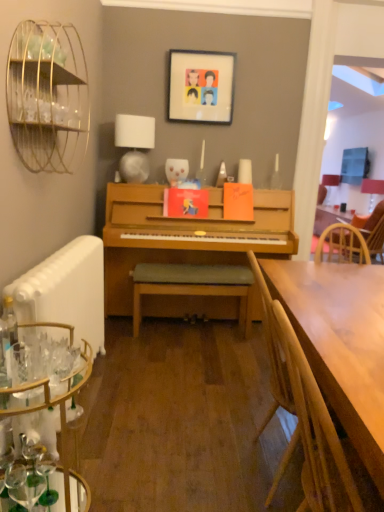
Question: Would you say wooden chair at right, which is the first chair from right to left, is inside or outside wooden bench at center?

Choices:
 (A) outside
 (B) inside

Answer: (A)

Question: From the image's perspective, is wooden chair at right, the second chair from the left, positioned above or below wooden bench at center?

Choices:
 (A) below
 (B) above

Answer: (B)

Question: Which is nearer to the wooden bench at center?

Choices:
 (A) wooden chair at right, which appears as the first chair when viewed from the front
 (B) clear glass desk at lower left
 (C) matte white lampshade at upper right, the first lamp from the right
 (D) wooden chair at right, positioned as the 1th chair in top-to-bottom order
 (E) gold wire birdcage at upper left

Answer: (D)

Question: Based on their relative distances, which object is nearer to the matte plastic picture frame at upper center?

Choices:
 (A) matte white lampshade at upper right, which is counted as the 1th lamp, starting from the back
 (B) wooden chair at right, the 2th chair from the front
 (C) white matte radiator at lower left
 (D) clear glass bottle at left
 (E) gold wire birdcage at upper left

Answer: (E)